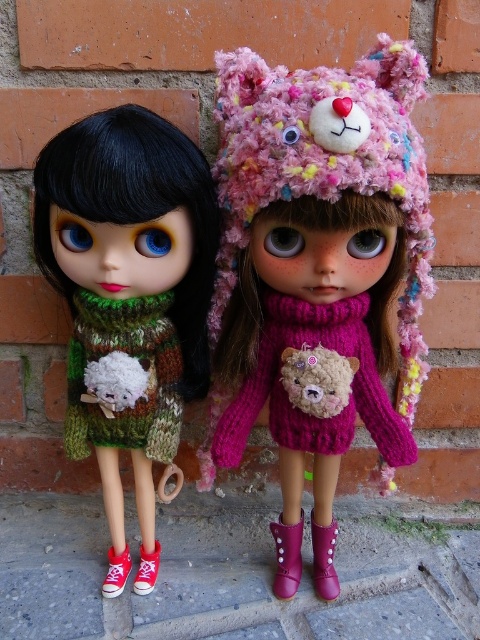
You are a child trying to decide which item to take from the dolls for a craft project. The fuzzy pink hat at center and the pink knitted sweater at center are both available. Which item is bigger in size?

The fuzzy pink hat at center is larger in size compared to the pink knitted sweater at center according to the description.

You are a child looking at the dolls and want to know which item is on the left side between the fuzzy pink hat at center and the pink knitted sweater at center. Can you tell me which one is positioned to the left?

The fuzzy pink hat at center is positioned to the left of the pink knitted sweater at center.

You are standing in front of the two dolls positioned against a brick wall backdrop. You want to place a small gift exactly halfway between the point at coordinates point (x=240, y=136) and the point at coordinates point (x=319, y=412). Will the gift be closer to the brick wall or the paved surface where the dolls are standing?

The gift placed halfway between point (x=240, y=136) and point (x=319, y=412) will be closer to the paved surface where the dolls are standing because the halfway point is closer to the lower coordinates of the paved surface compared to the brick wall backdrop.